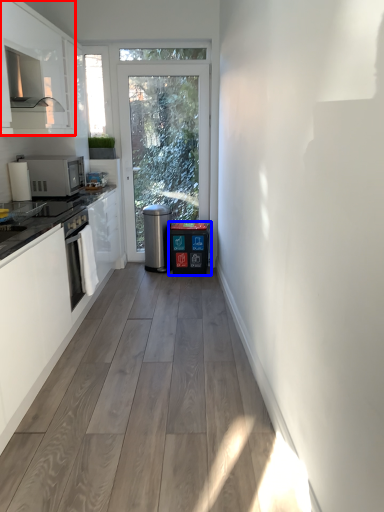
Question: Which object is closer to the camera taking this photo, cabinetry (highlighted by a red box) or dish washer (highlighted by a blue box)?

Choices:
 (A) cabinetry
 (B) dish washer

Answer: (A)